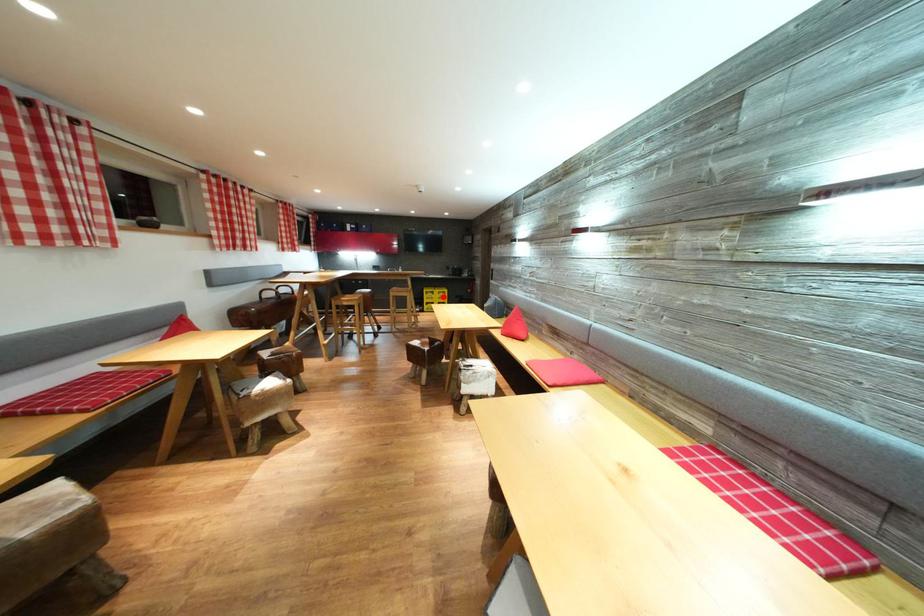
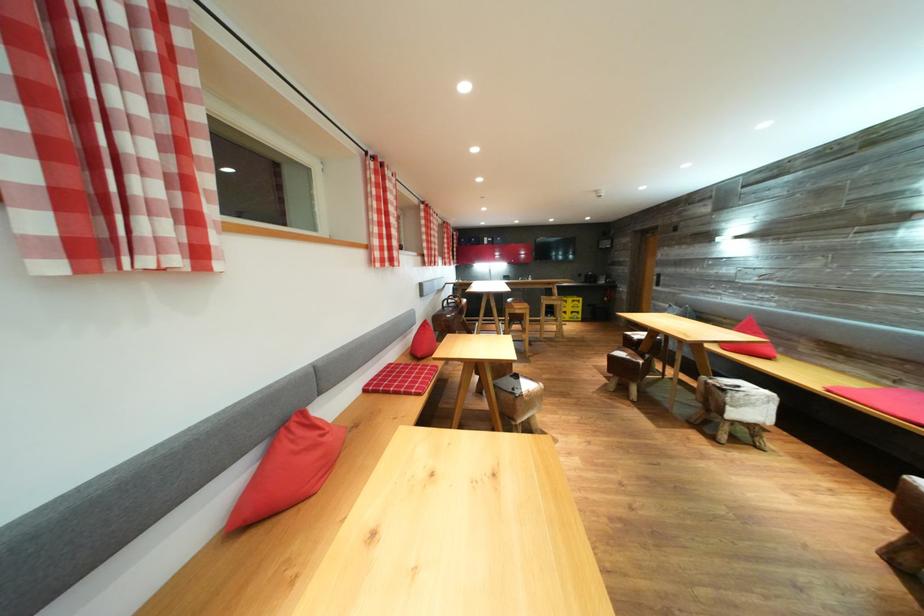
Question: I am providing you with two images of the same scene from different viewpoints. Image1 has a red point marked. In image2, the corresponding 3D location appears at what relative position? Reply with the corresponding letter.

Choices:
 (A) Closer
 (B) Farther

Answer: (B)